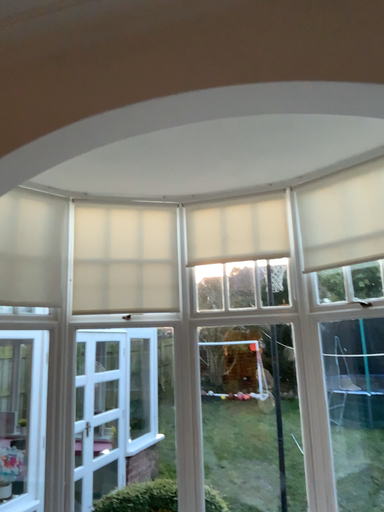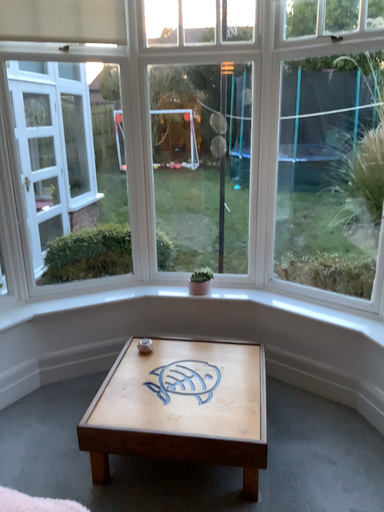
Question: Which way did the camera rotate in the video?

Choices:
 (A) rotated downward
 (B) rotated upward

Answer: (A)